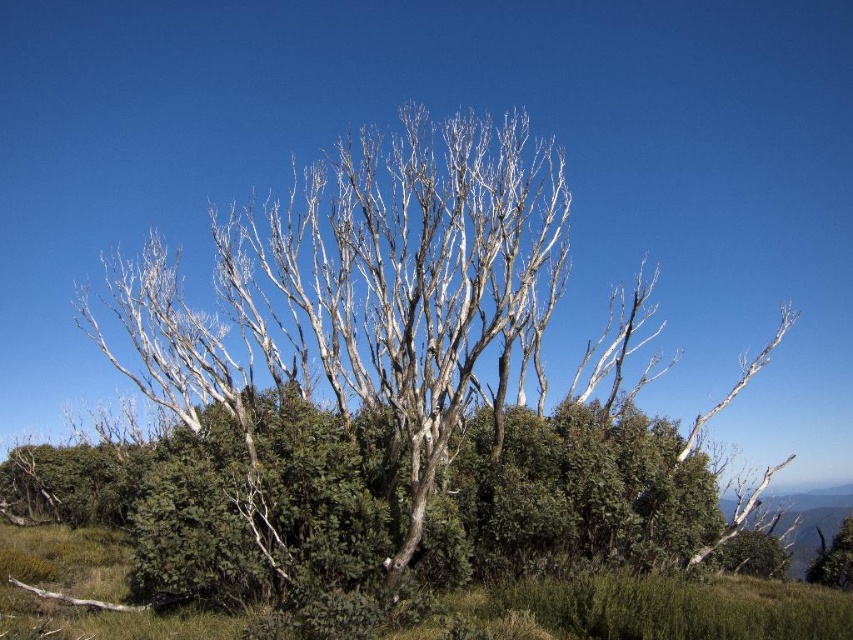
Question: Which point is farther to the camera?

Choices:
 (A) green matte grass at lower center
 (B) white bark tree at center

Answer: (B)

Question: Observing the image, what is the correct spatial positioning of white bark tree at center in reference to green matte grass at lower center?

Choices:
 (A) left
 (B) right

Answer: (B)

Question: Does white bark tree at center have a larger size compared to green matte grass at lower center?

Choices:
 (A) yes
 (B) no

Answer: (A)

Question: Is white bark tree at center in front of green matte grass at lower center?

Choices:
 (A) yes
 (B) no

Answer: (B)